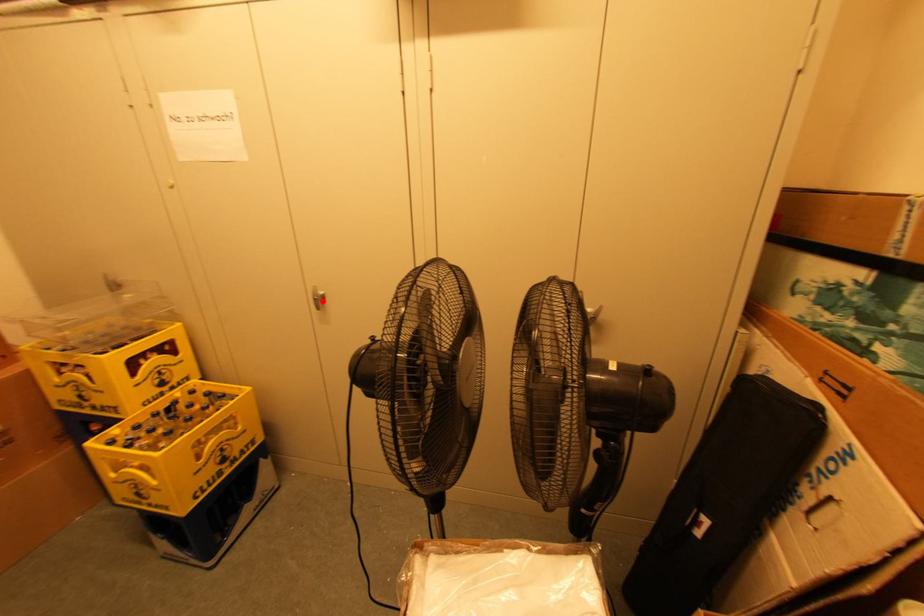
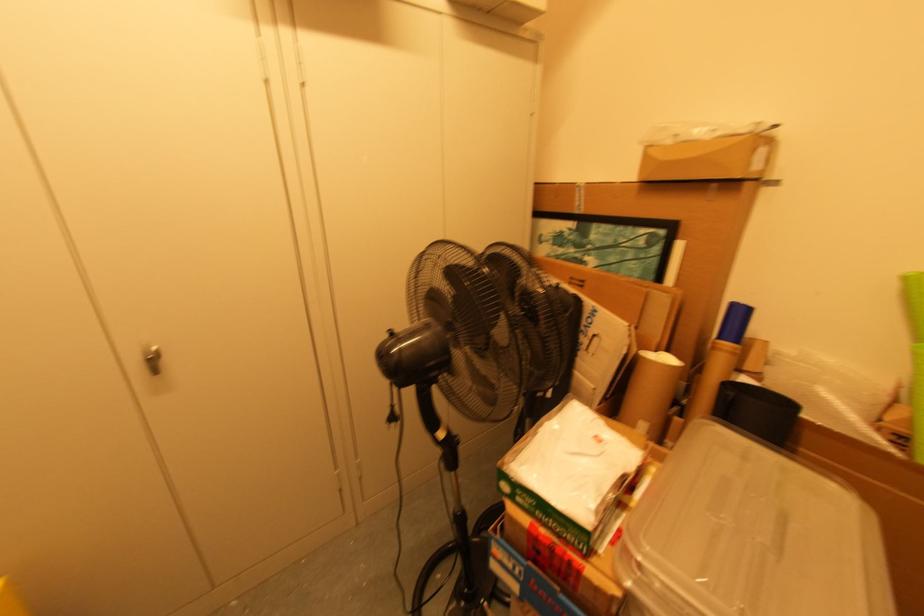
In the second image, find the point that corresponds to the highlighted location in the first image.

(152, 361)